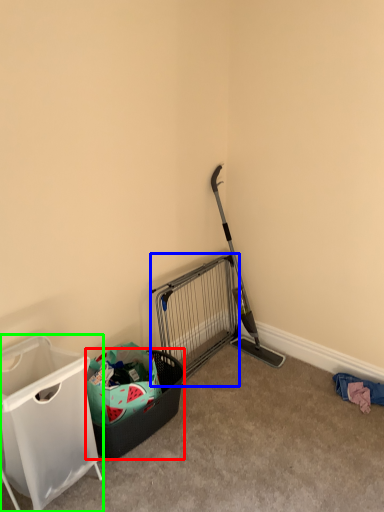
Question: Which is nearer to the shopping basket (highlighted by a red box)? cage (highlighted by a blue box) or waste container (highlighted by a green box).

Choices:
 (A) cage
 (B) waste container

Answer: (B)